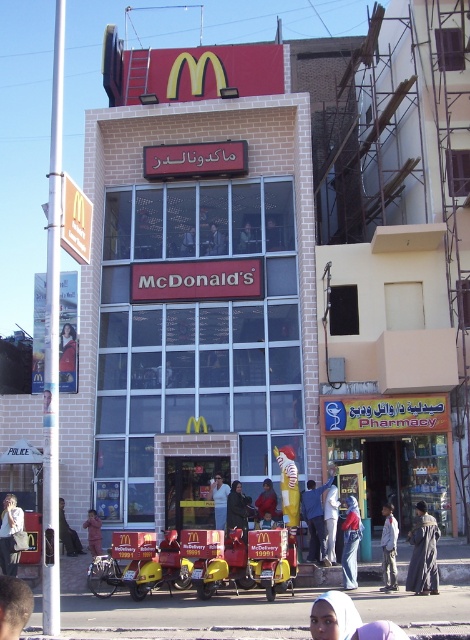
You are a photographer standing at the entrance of the McDonalds. You want to take a photo of the light purple fabric headscarf at lower center and the dark brown leather jacket at lower left. Which object should be placed closer to the camera to ensure both are in focus?

The light purple fabric headscarf at lower center is in front of the dark brown leather jacket at lower left, so to ensure both are in focus, the light purple fabric headscarf at lower center should be placed closer to the camera.

You are standing in front of the McDonalds restaurant and need to locate two specific points marked on the facade. The first point is at coordinate point(344,604) and the second at point(7,532). Which of these two points is closer to you?

Point(344,604) is closer to the viewer than point(7,532).

You are standing in front of the McDonalds restaurant and want to take a photo of the two points marked on the building. Which point, point (399,628) or point (60,532), will appear larger in your photo?

Point (399,628) will appear larger in the photo because it is closer to the camera than point (60,532).